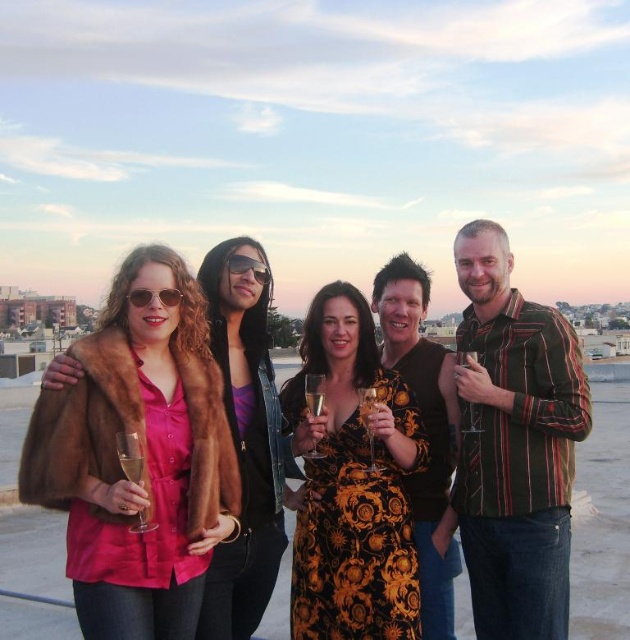
Question: Does striped cotton shirt at right lie in front of floral dress at center?

Choices:
 (A) yes
 (B) no

Answer: (A)

Question: Which point is closer to the camera?

Choices:
 (A) floral dress at center
 (B) striped cotton shirt at right
 (C) black textured shirt at center

Answer: (B)

Question: From the image, what is the correct spatial relationship of striped cotton shirt at right in relation to black textured shirt at center?

Choices:
 (A) right
 (B) left

Answer: (A)

Question: Is striped cotton shirt at right above floral dress at center?

Choices:
 (A) no
 (B) yes

Answer: (B)

Question: Which object is closer to the camera taking this photo?

Choices:
 (A) floral dress at center
 (B) striped cotton shirt at right
 (C) black textured shirt at center

Answer: (B)

Question: Which point is farther to the camera?

Choices:
 (A) matte brown fur coat at center
 (B) black textured shirt at center

Answer: (B)